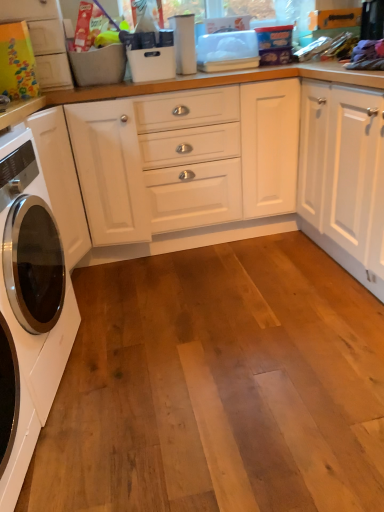
Question: From the image's perspective, is matte cardboard box at upper left above or below white glossy washing machine at left?

Choices:
 (A) above
 (B) below

Answer: (A)

Question: Choose the correct answer: Is matte cardboard box at upper left inside white glossy washing machine at left or outside it?

Choices:
 (A) outside
 (B) inside

Answer: (A)

Question: Is point (33, 42) closer or farther from the camera than point (8, 406)?

Choices:
 (A) closer
 (B) farther

Answer: (B)

Question: In terms of width, does white glossy washing machine at left look wider or thinner when compared to matte cardboard box at upper left?

Choices:
 (A) thin
 (B) wide

Answer: (B)

Question: Would you say white glossy washing machine at left is to the left or to the right of matte cardboard box at upper left in the picture?

Choices:
 (A) right
 (B) left

Answer: (A)

Question: Choose the correct answer: Is white glossy washing machine at left inside matte cardboard box at upper left or outside it?

Choices:
 (A) inside
 (B) outside

Answer: (B)

Question: Considering their positions, is white glossy washing machine at left located in front of or behind matte cardboard box at upper left?

Choices:
 (A) front
 (B) behind

Answer: (A)